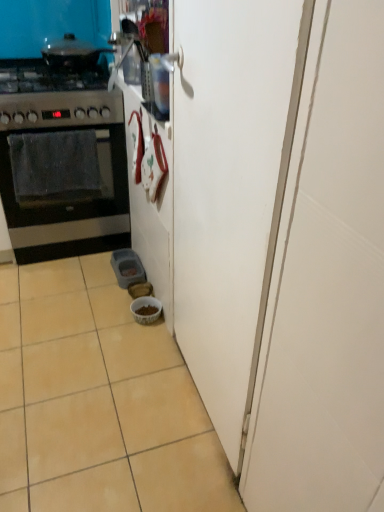
Question: Could you tell me if shiny black pot at upper left is facing stainless steel gas stove at left?

Choices:
 (A) yes
 (B) no

Answer: (B)

Question: Is shiny black pot at upper left in front of stainless steel gas stove at left?

Choices:
 (A) no
 (B) yes

Answer: (A)

Question: Does shiny black pot at upper left have a larger size compared to stainless steel gas stove at left?

Choices:
 (A) no
 (B) yes

Answer: (A)

Question: Considering the relative sizes of shiny black pot at upper left and stainless steel gas stove at left in the image provided, is shiny black pot at upper left thinner than stainless steel gas stove at left?

Choices:
 (A) no
 (B) yes

Answer: (B)

Question: Is stainless steel gas stove at left surrounded by shiny black pot at upper left?

Choices:
 (A) no
 (B) yes

Answer: (A)

Question: Can you confirm if shiny black pot at upper left is smaller than stainless steel gas stove at left?

Choices:
 (A) yes
 (B) no

Answer: (A)

Question: From the image's perspective, would you say black matte oven at left is shown under white matte door at center?

Choices:
 (A) no
 (B) yes

Answer: (A)

Question: Does black matte oven at left have a larger size compared to white matte door at center?

Choices:
 (A) no
 (B) yes

Answer: (A)

Question: Could you tell me if black matte oven at left is facing white matte door at center?

Choices:
 (A) no
 (B) yes

Answer: (B)

Question: Does black matte oven at left lie behind white matte door at center?

Choices:
 (A) no
 (B) yes

Answer: (B)

Question: Can you confirm if black matte oven at left is wider than white matte door at center?

Choices:
 (A) yes
 (B) no

Answer: (B)

Question: Is black matte oven at left outside white matte door at center?

Choices:
 (A) yes
 (B) no

Answer: (A)

Question: Does beige ceramic tile at lower left appear on the right side of black matte oven at left?

Choices:
 (A) no
 (B) yes

Answer: (B)